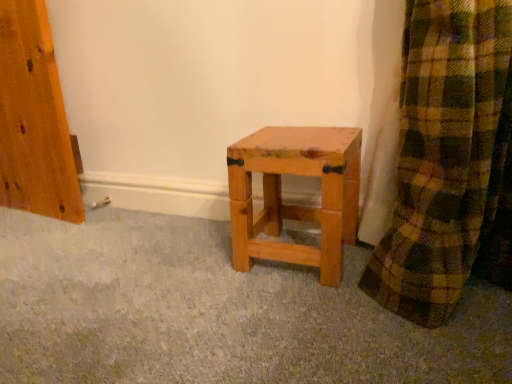
Locate an element on the screen. The width and height of the screenshot is (512, 384). free space to the left of natural wood stool at center is located at coordinates (196, 256).